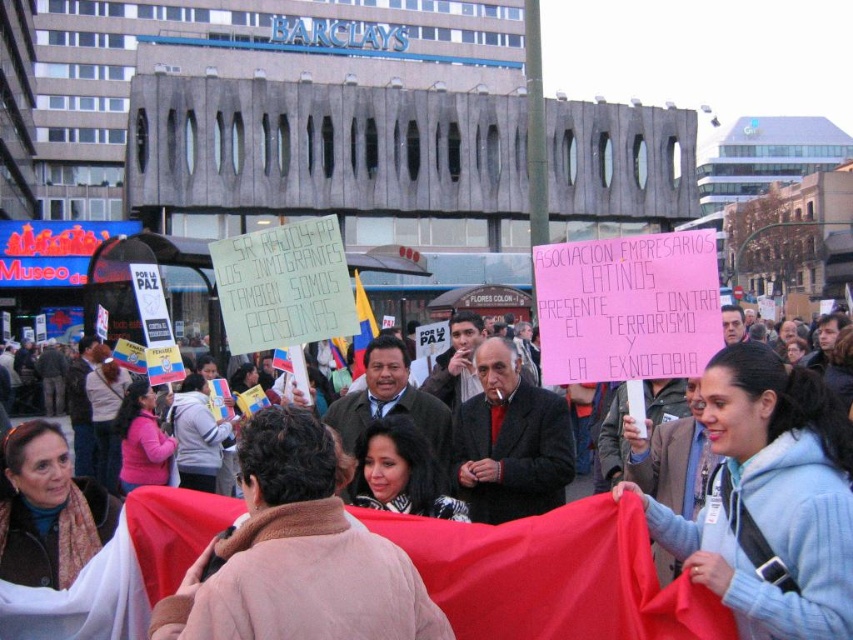
At what (x,y) coordinates should I click in order to perform the action: click on light blue fleece jacket at lower right. Please return your answer as a coordinate pair (x, y). The width and height of the screenshot is (853, 640). Looking at the image, I should click on (769, 499).

Is the position of light blue fleece jacket at lower right less distant than that of smooth black hair at center?

That is True.

Locate an element on the screen. light blue fleece jacket at lower right is located at coordinates (769, 499).

Is point (666, 516) in front of point (55, 540)?

Yes.

Does light blue fleece jacket at lower right have a larger size compared to brown scarf at center?

Yes, light blue fleece jacket at lower right is bigger than brown scarf at center.

Who is more distant from viewer, [674,531] or [3,556]?

The point [674,531] is behind.

Identify the location of light blue fleece jacket at lower right. Image resolution: width=853 pixels, height=640 pixels. (769, 499).

Is pink fleece jacket at lower left bigger than matte pink scarf at center?

No, pink fleece jacket at lower left is not bigger than matte pink scarf at center.

Which is below, pink fleece jacket at lower left or matte pink scarf at center?

pink fleece jacket at lower left

Describe the element at coordinates (142, 440) in the screenshot. The image size is (853, 640). I see `pink fleece jacket at lower left` at that location.

I want to click on pink fleece jacket at lower left, so click(142, 440).